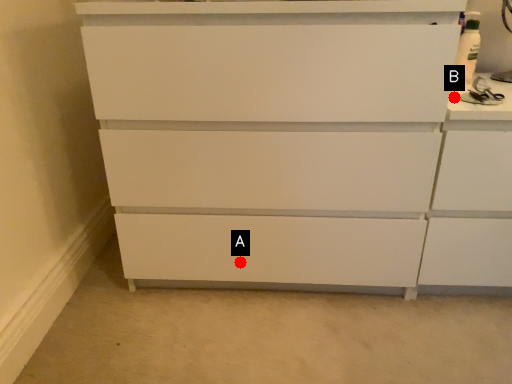
Question: Two points are circled on the image, labeled by A and B beside each circle. Which point appears farthest from the camera in this image?

Choices:
 (A) A is further
 (B) B is further

Answer: (A)